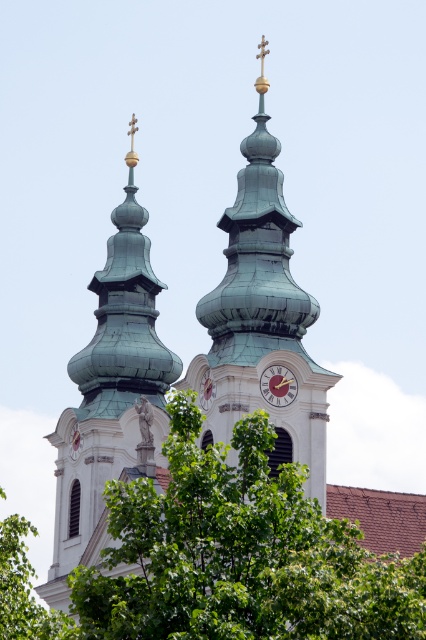
Question: Among these points, which one is nearest to the camera?

Choices:
 (A) (57, 541)
 (B) (287, 412)
 (C) (325, 600)
 (D) (270, 385)

Answer: (C)

Question: Does green copper clock tower at center have a smaller size compared to green copper tower at left?

Choices:
 (A) yes
 (B) no

Answer: (A)

Question: Is green copper tower at left positioned before green leafy tree at lower left?

Choices:
 (A) no
 (B) yes

Answer: (A)

Question: Is green leafy tree at center wider than green copper tower at left?

Choices:
 (A) no
 (B) yes

Answer: (B)

Question: Among these points, which one is farthest from the camera?

Choices:
 (A) (290, 376)
 (B) (83, 637)
 (C) (206, 390)

Answer: (C)

Question: Among these objects, which one is farthest from the camera?

Choices:
 (A) green copper tower at left
 (B) green leafy tree at lower left
 (C) green copper clock tower at center

Answer: (A)